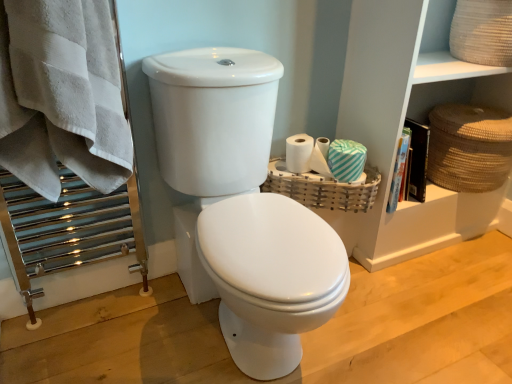
Question: Is point (226, 211) positioned closer to the camera than point (446, 132)?

Choices:
 (A) farther
 (B) closer

Answer: (B)

Question: Is white glossy toilet at center situated inside brown woven basket at right, the 1th basket viewed from the right, or outside?

Choices:
 (A) inside
 (B) outside

Answer: (B)

Question: Which object is positioned farthest from the woven wood basket at right, arranged as the 1th basket when viewed from the left?

Choices:
 (A) rattan basket at upper right, which ranks as the first shelf in bottom-to-top order
 (B) white matte toilet paper at center, the 2th toilet paper in the right-to-left sequence
 (C) white cotton towel at left
 (D) white glossy toilet at center
 (E) brown woven basket at right, the second basket when ordered from left to right

Answer: (C)

Question: Estimate the real-world distances between objects in this image. Which object is closer to the white glossy toilet at center?

Choices:
 (A) white cotton towel at left
 (B) brown woven basket at right, the second basket when ordered from left to right
 (C) woven beige basket at upper right, the first shelf when ordered from top to bottom
 (D) teal striped toilet paper at right, the first toilet paper positioned from the right
 (E) rattan basket at upper right, acting as the second shelf starting from the top

Answer: (A)